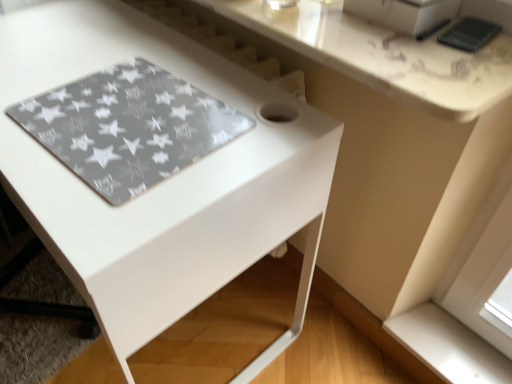
What is the approximate width of white glossy table at center?

It is 21.71 inches.

The image size is (512, 384). Describe the element at coordinates (128, 127) in the screenshot. I see `transparent star-patterned mat at lower left` at that location.

At what (x,y) coordinates should I click in order to perform the action: click on white smooth window sill at lower right. Please return your answer as a coordinate pair (x, y). The image size is (512, 384). Looking at the image, I should click on (448, 346).

What do you see at coordinates (385, 56) in the screenshot? I see `white glossy counter top at upper center` at bounding box center [385, 56].

You are a GUI agent. You are given a task and a screenshot of the screen. Output one action in this format:
    pyautogui.click(x=<x>, y=<y>)
    Task: Click on the white glossy counter top at upper center
    This screenshot has width=512, height=384.
    Given the screenshot: What is the action you would take?
    pyautogui.click(x=385, y=56)

Locate an element on the screen. white glossy table at center is located at coordinates (164, 181).

From the image's perspective, between white smooth window sill at lower right and transparent star-patterned mat at lower left, who is located below?

white smooth window sill at lower right is shown below in the image.

Consider the image. From a real-world perspective, which object rests below the other?

white smooth window sill at lower right, from a real-world perspective.

Looking at the image, does white smooth window sill at lower right seem bigger or smaller compared to transparent star-patterned mat at lower left?

Considering their sizes, white smooth window sill at lower right takes up more space than transparent star-patterned mat at lower left.

Is black matte phone at upper right oriented towards white glossy counter top at upper center?

Yes, black matte phone at upper right is aimed at white glossy counter top at upper center.

Considering the positions of points (465, 39) and (502, 34), is point (465, 39) farther from camera compared to point (502, 34)?

Yes.

Who is more distant, black matte phone at upper right or white glossy counter top at upper center?

black matte phone at upper right is more distant.

Considering their positions, is white glossy table at center located in front of or behind white glossy counter top at upper center?

white glossy table at center is in front of white glossy counter top at upper center.

Does point (36, 46) lie behind point (432, 73)?

That is True.

Does white glossy table at center turn towards white glossy counter top at upper center?

No, white glossy table at center is not aimed at white glossy counter top at upper center.

From a real-world perspective, is white glossy table at center on white glossy counter top at upper center?

No.

Considering their positions, is white glossy table at center located in front of or behind transparent star-patterned mat at lower left?

white glossy table at center is positioned closer to the viewer than transparent star-patterned mat at lower left.

From a real-world perspective, is white glossy table at center on top of transparent star-patterned mat at lower left?

No, from a real-world perspective, white glossy table at center is not above transparent star-patterned mat at lower left.

How much distance is there between white glossy table at center and transparent star-patterned mat at lower left?

A distance of 5.15 inches exists between white glossy table at center and transparent star-patterned mat at lower left.

Is white glossy counter top at upper center far from black matte phone at upper right?

No, white glossy counter top at upper center is not far from black matte phone at upper right.

Can you confirm if white glossy counter top at upper center is positioned to the left of black matte phone at upper right?

Correct, you'll find white glossy counter top at upper center to the left of black matte phone at upper right.

Considering the positions of point (413, 93) and point (472, 36), is point (413, 93) closer or farther from the camera than point (472, 36)?

Point (413, 93) appears to be closer to the viewer than point (472, 36).

In terms of height, does transparent star-patterned mat at lower left look taller or shorter compared to white smooth window sill at lower right?

In the image, transparent star-patterned mat at lower left appears to be shorter than white smooth window sill at lower right.

Measure the distance between transparent star-patterned mat at lower left and white smooth window sill at lower right.

transparent star-patterned mat at lower left is 34.94 inches away from white smooth window sill at lower right.

Which object is further away from the camera, transparent star-patterned mat at lower left or white smooth window sill at lower right?

white smooth window sill at lower right is further away from the camera.

Is transparent star-patterned mat at lower left spatially inside white smooth window sill at lower right, or outside of it?

transparent star-patterned mat at lower left exists outside the volume of white smooth window sill at lower right.

Would you consider transparent star-patterned mat at lower left to be distant from black matte phone at upper right?

They are positioned close to each other.

Would you say transparent star-patterned mat at lower left is outside black matte phone at upper right?

Yes, transparent star-patterned mat at lower left is outside of black matte phone at upper right.

From a real-world perspective, is transparent star-patterned mat at lower left physically below black matte phone at upper right?

Yes, from a real-world perspective, transparent star-patterned mat at lower left is below black matte phone at upper right.

Is transparent star-patterned mat at lower left to the left of black matte phone at upper right from the viewer's perspective?

Indeed, transparent star-patterned mat at lower left is positioned on the left side of black matte phone at upper right.

Find the location of a particular element. The width and height of the screenshot is (512, 384). mat on the left of white smooth window sill at lower right is located at coordinates (128, 127).

Where is `pad that is above the white glossy counter top at upper center (from a real-world perspective)`? pad that is above the white glossy counter top at upper center (from a real-world perspective) is located at coordinates (470, 34).

From the image, which object appears to be farther from white smooth window sill at lower right, white glossy table at center or white glossy counter top at upper center?

The object further to white smooth window sill at lower right is white glossy counter top at upper center.

Which object lies nearer to the anchor point transparent star-patterned mat at lower left, white glossy table at center or black matte phone at upper right?

The object closer to transparent star-patterned mat at lower left is white glossy table at center.

Considering their positions, is transparent star-patterned mat at lower left positioned closer to black matte phone at upper right than white glossy counter top at upper center?

white glossy counter top at upper center is positioned closer to the anchor black matte phone at upper right.

Which object lies further to the anchor point black matte phone at upper right, transparent star-patterned mat at lower left or white smooth window sill at lower right?

white smooth window sill at lower right is positioned further to the anchor black matte phone at upper right.

When comparing their distances from transparent star-patterned mat at lower left, does white smooth window sill at lower right or white glossy counter top at upper center seem further?

white smooth window sill at lower right is positioned further to the anchor transparent star-patterned mat at lower left.

From the image, which object appears to be nearer to white glossy counter top at upper center, white smooth window sill at lower right or black matte phone at upper right?

The object closer to white glossy counter top at upper center is black matte phone at upper right.

Which object lies further to the anchor point white glossy counter top at upper center, white glossy table at center or transparent star-patterned mat at lower left?

Based on the image, transparent star-patterned mat at lower left appears to be further to white glossy counter top at upper center.

Based on their spatial positions, is black matte phone at upper right or white glossy counter top at upper center closer to white glossy table at center?

Based on the image, white glossy counter top at upper center appears to be nearer to white glossy table at center.

You are a GUI agent. You are given a task and a screenshot of the screen. Output one action in this format:
    pyautogui.click(x=<x>, y=<y>)
    Task: Click on the pad between white glossy counter top at upper center and white smooth window sill at lower right in the up-down direction
    
    Given the screenshot: What is the action you would take?
    pyautogui.click(x=470, y=34)

This screenshot has height=384, width=512. I want to click on mat between white glossy table at center and black matte phone at upper right from left to right, so click(x=128, y=127).

Find the location of a particular element. counter top between transparent star-patterned mat at lower left and black matte phone at upper right from left to right is located at coordinates (385, 56).

Image resolution: width=512 pixels, height=384 pixels. Identify the location of pad between transparent star-patterned mat at lower left and white smooth window sill at lower right. (470, 34).